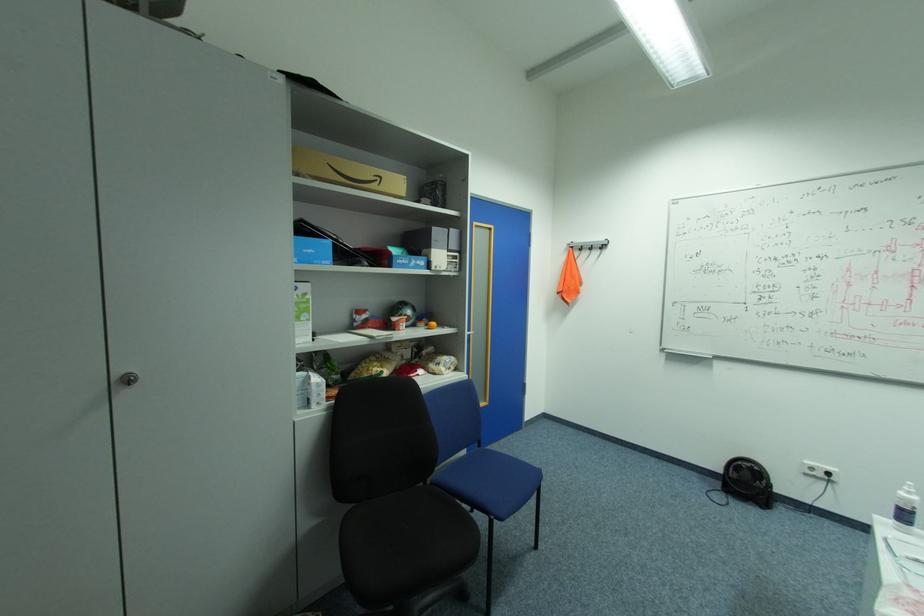
Find where to pull the recessed door handle. Please return your answer as a coordinate pair (x, y).

(128, 379)